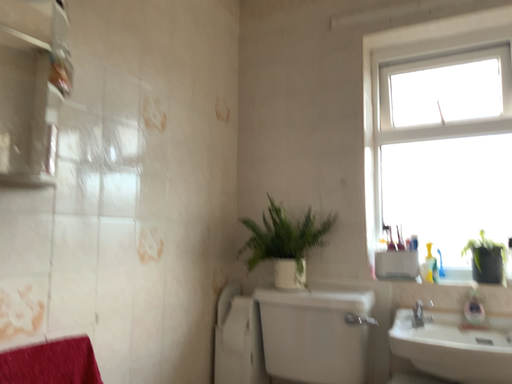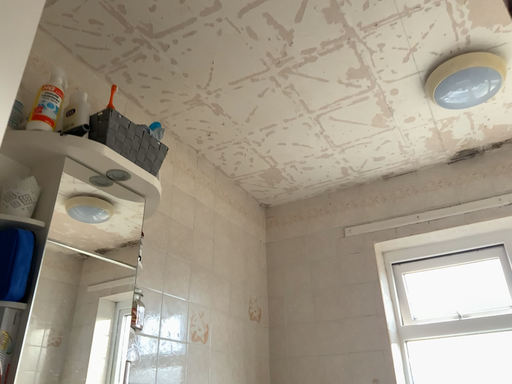
Question: How did the camera likely rotate when shooting the video?

Choices:
 (A) rotated upward
 (B) rotated downward

Answer: (A)